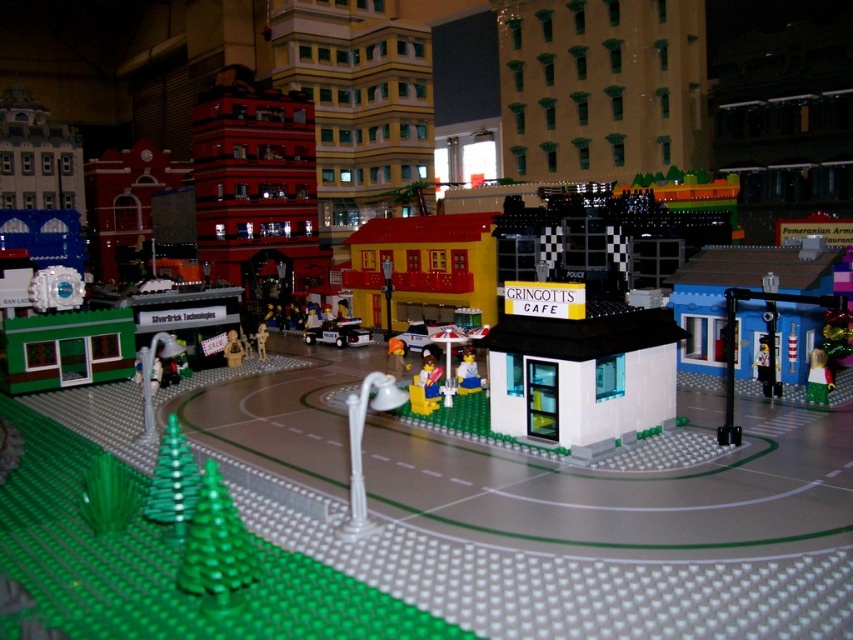
Question: Which point is farther to the camera?

Choices:
 (A) translucent yellow figure at center
 (B) white plastic street lamp at center

Answer: (A)

Question: Is smooth yellow minifigure at center to the right of green plastic minifigure at center-right from the viewer's perspective?

Choices:
 (A) no
 (B) yes

Answer: (A)

Question: Does green matte christmas tree at lower left come behind green plastic minifigure at center-right?

Choices:
 (A) no
 (B) yes

Answer: (A)

Question: Which point appears closest to the camera in this image?

Choices:
 (A) (370, 524)
 (B) (154, 490)
 (C) (821, 384)

Answer: (A)

Question: Which of the following is the closest to the observer?

Choices:
 (A) matte plastic figure at center
 (B) green plastic trees at lower left
 (C) white plastic street lamp at center
 (D) green plastic minifigure at center-right

Answer: (B)

Question: From the image, what is the correct spatial relationship of green matte christmas tree at lower left in relation to matte plastic figure at center?

Choices:
 (A) right
 (B) left

Answer: (A)